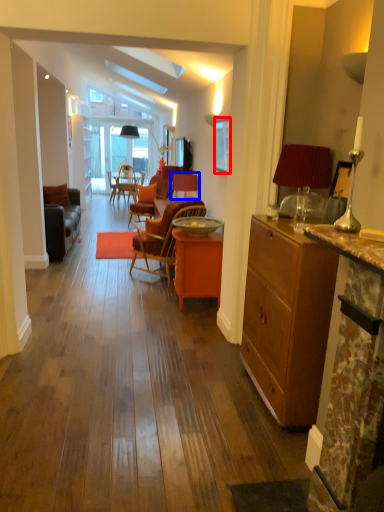
Question: Which object appears farthest to the camera in this image, picture frame (highlighted by a red box) or chair (highlighted by a blue box)?

Choices:
 (A) picture frame
 (B) chair

Answer: (B)